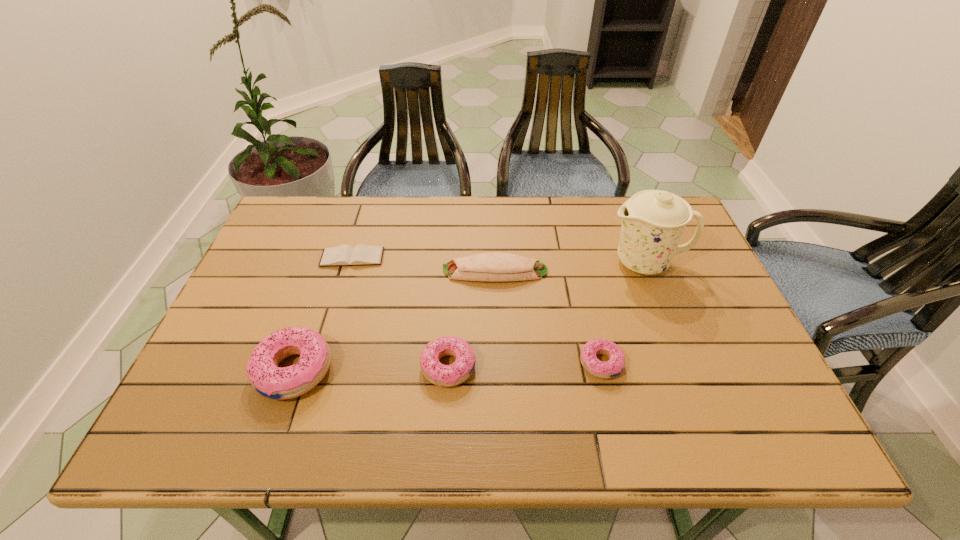
Locate an element on the screen. free space between the diary and the burrito is located at coordinates coord(423,264).

You are a GUI agent. You are given a task and a screenshot of the screen. Output one action in this format:
    pyautogui.click(x=<x>, y=<y>)
    Task: Click on the unoccupied area between the tallest object and the burrito
    The image size is (960, 540).
    Given the screenshot: What is the action you would take?
    pyautogui.click(x=570, y=267)

Image resolution: width=960 pixels, height=540 pixels. I want to click on vacant area between the tallest object and the fifth shortest object, so click(470, 316).

At what (x,y) coordinates should I click in order to perform the action: click on vacant point located between the burrito and the third tallest object. Please return your answer as a coordinate pair (x, y). Looking at the image, I should click on (471, 319).

Locate an element on the screen. This screenshot has height=540, width=960. vacant area between the third tallest object and the burrito is located at coordinates (471, 319).

Identify the location of unoccupied area between the burrito and the second tallest doughnut. (471, 319).

Locate an element on the screen. This screenshot has height=540, width=960. free area in between the rightmost doughnut and the diary is located at coordinates (476, 310).

The width and height of the screenshot is (960, 540). I want to click on the second closest object to the shortest doughnut, so click(x=653, y=223).

Identify which object is the third nearest to the leftmost doughnut. Please provide its 2D coordinates. Your answer should be formatted as a tuple, i.e. [(x, y)], where the tuple contains the x and y coordinates of a point satisfying the conditions above.

[(494, 266)]

At what (x,y) coordinates should I click in order to perform the action: click on the closest doughnut relative to the tallest object. Please return your answer as a coordinate pair (x, y). This screenshot has width=960, height=540. Looking at the image, I should click on (614, 366).